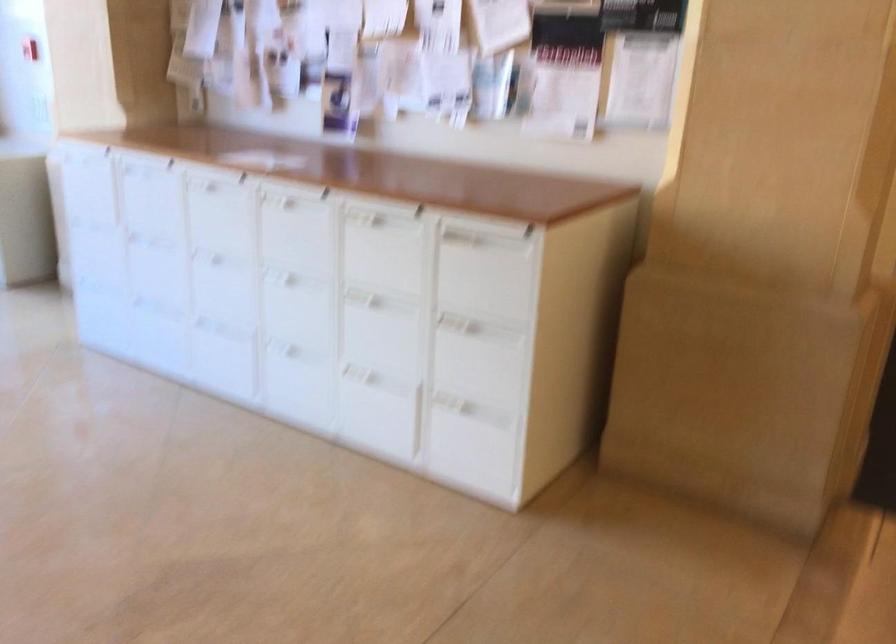
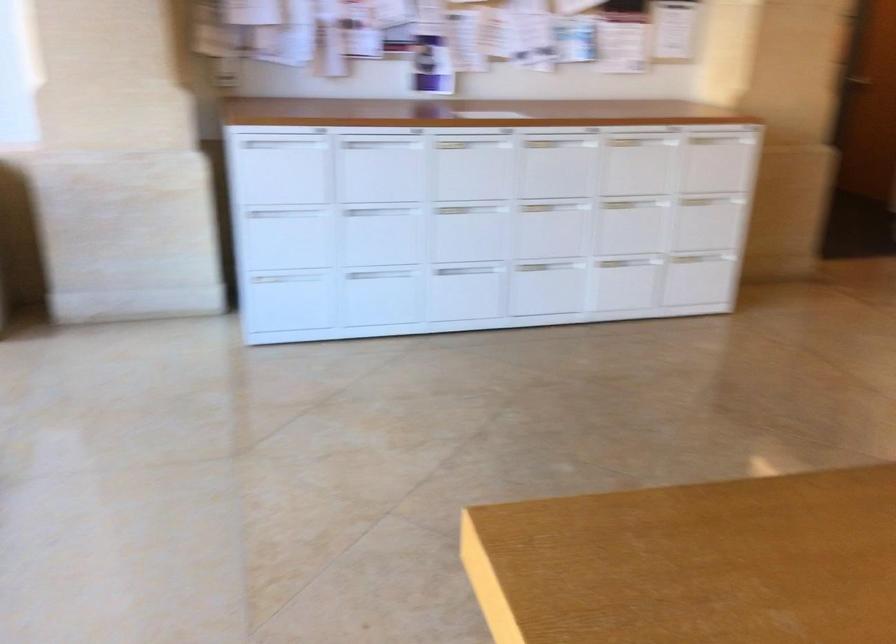
Locate, in the second image, the point that corresponds to the point at 228,218 in the first image.

(471, 167)